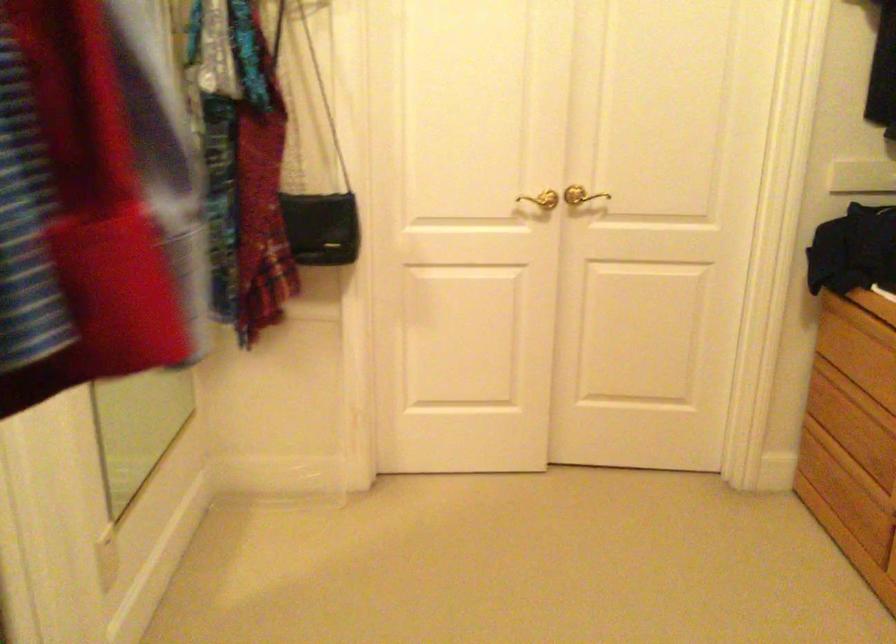
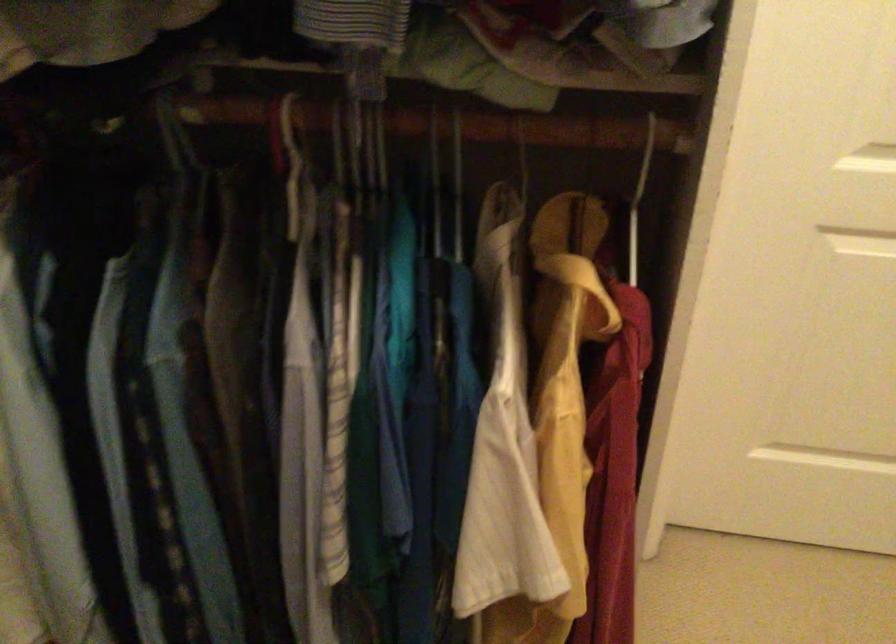
How did the camera likely rotate?

The rotation direction of the camera is left-down.